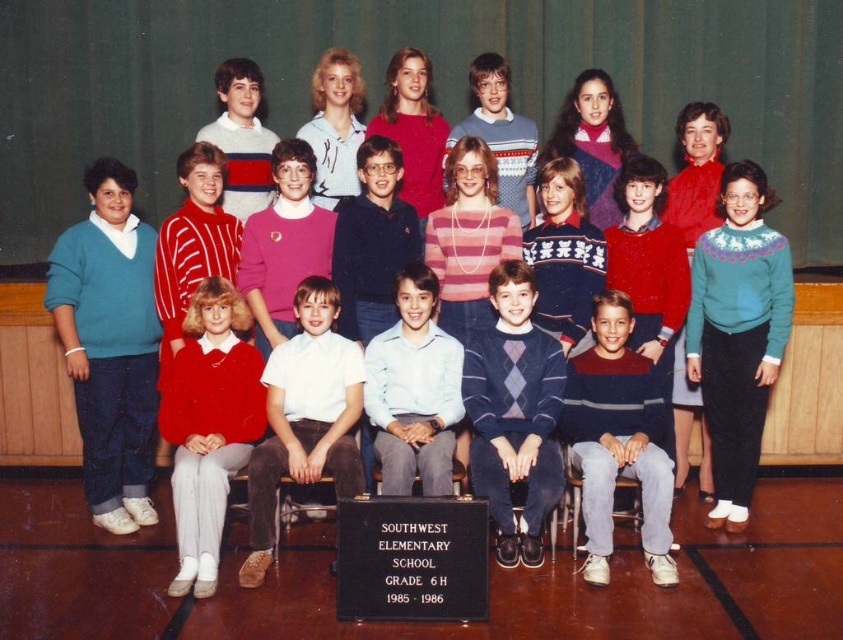
In the group photo of Southwest Elementary School Grade 6H from 1985, there are two students wearing distinctive sweaters. The first student is wearing a teal sweater at left, and the second is wearing a striped knit sweater at center. From the perspective of someone standing in front of the photo, which sweater is positioned more to the left?

The teal sweater at left is positioned more to the left than the striped knit sweater at center.

In the group photo of Southwest Elementary School, Grade 6H, you notice two students wearing distinctive sweaters. The first is a teal sweater at left, and the second is a striped knit sweater at center. Which sweater is taller?

The teal sweater at left is taller than the striped knit sweater at center.